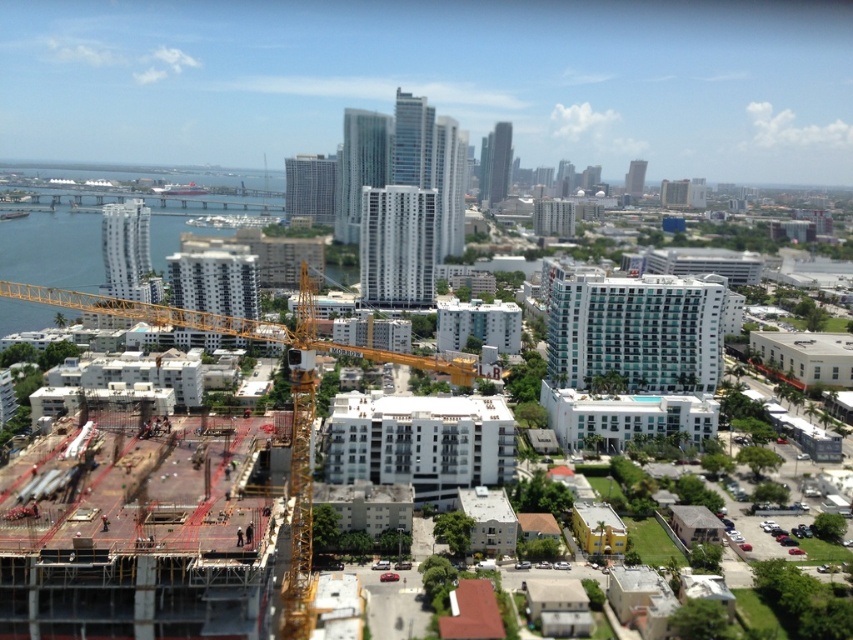
Is blue glass water at left taller than yellow metallic crane at center-left?

Indeed, blue glass water at left has a greater height compared to yellow metallic crane at center-left.

Is blue glass water at left above yellow metallic crane at center-left?

Yes, blue glass water at left is above yellow metallic crane at center-left.

At what (x,y) coordinates should I click in order to perform the action: click on blue glass water at left. Please return your answer as a coordinate pair (x, y). The width and height of the screenshot is (853, 640). Looking at the image, I should click on (97, 234).